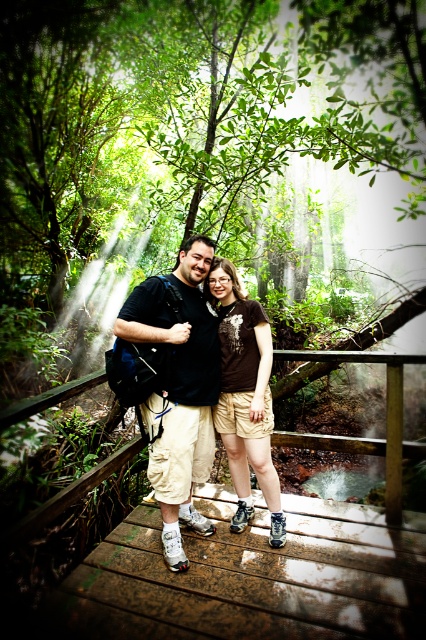
You are a hiker trying to cross the brown wooden bridge at center. You notice the brown fabric shorts at center nearby. Based on the scene, where is the brown wooden bridge located relative to the brown fabric shorts?

The brown wooden bridge at center is positioned under the brown fabric shorts at center.